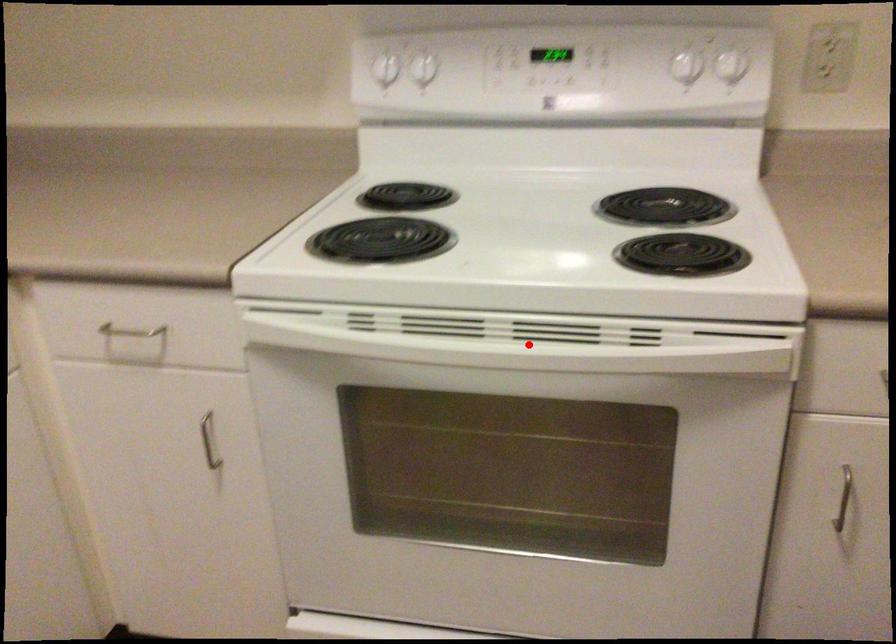
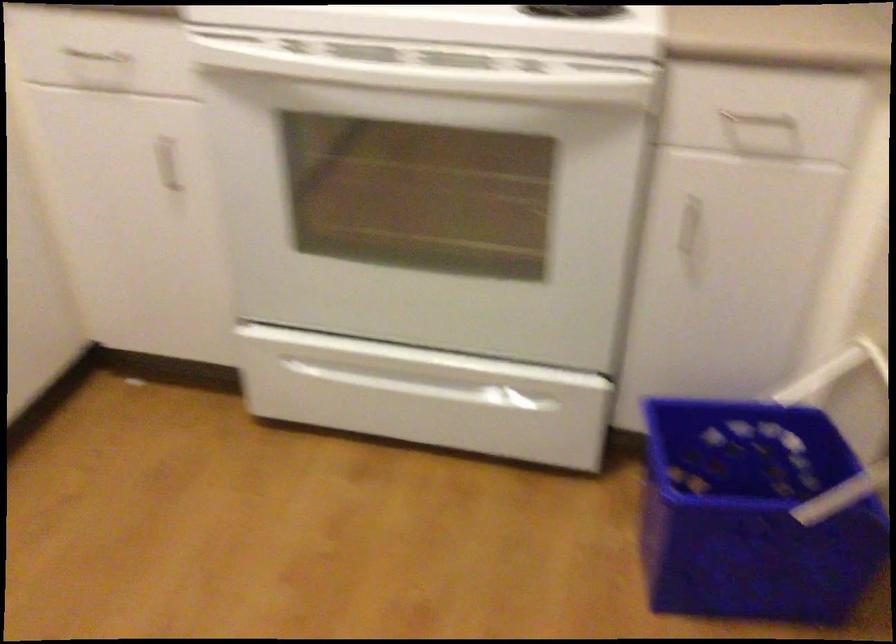
Question: I am providing you with two images of the same scene from different viewpoints. A red point is shown in image1. For the corresponding object point in image2, is it positioned nearer or farther from the camera?

Choices:
 (A) Nearer
 (B) Farther

Answer: (B)